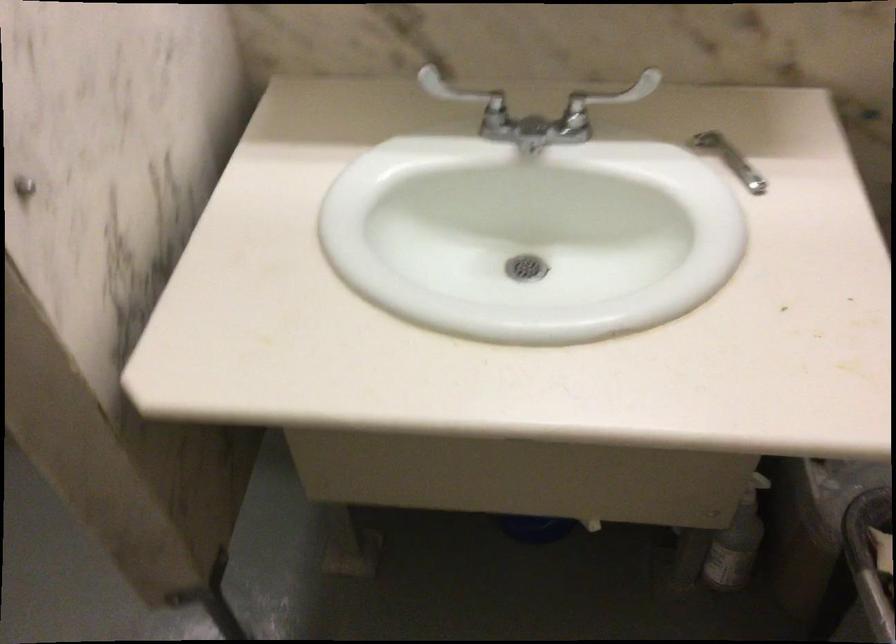
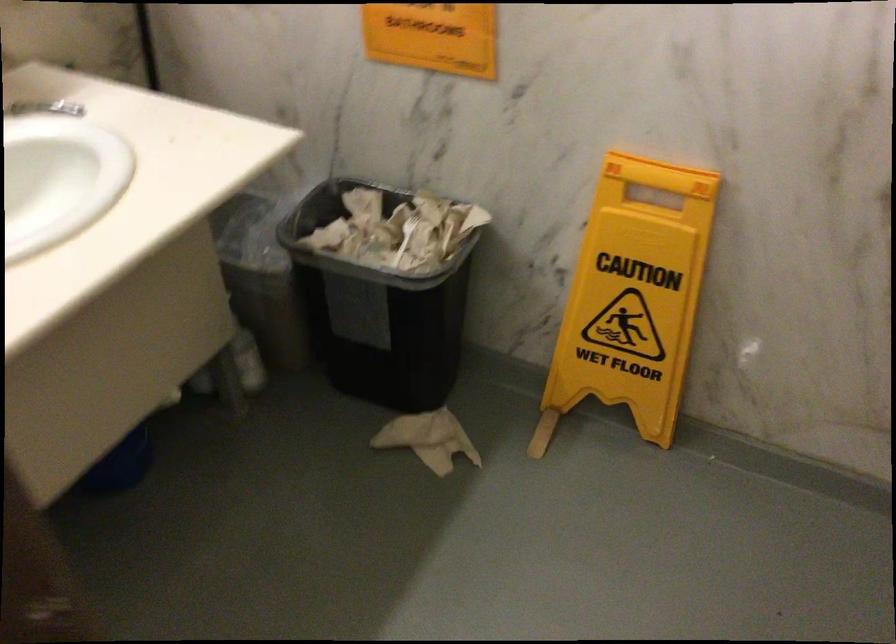
Find the pixel in the second image that matches point 725,147 in the first image.

(45, 108)